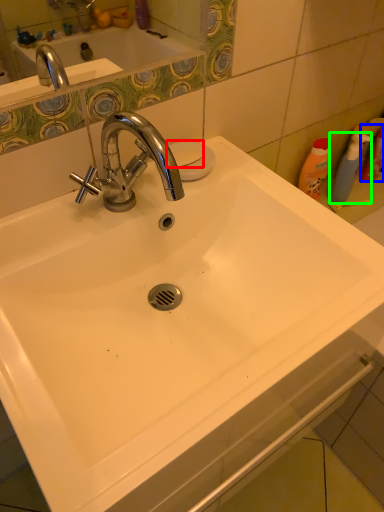
Question: Which object is the closest to the soap (highlighted by a red box)? Choose among these: cleaning product (highlighted by a blue box) or cleaning product (highlighted by a green box).

Choices:
 (A) cleaning product
 (B) cleaning product

Answer: (B)